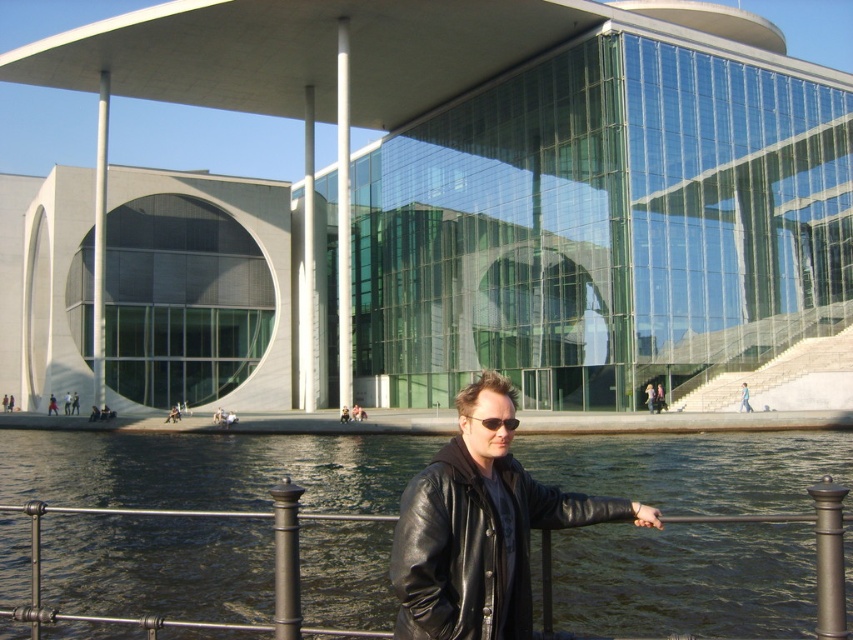
You are a tourist visiting the modern architectural structure. You want to take a photo of the glassy concrete building at center without any water in the frame. Is it possible to position yourself in such a way that the dark green water at lower center is completely out of the shot?

The glassy concrete building at center is positioned over dark green water at lower center, so it is not possible to capture the building without including the water in the frame since the water is directly beneath it.

You are standing at the edge of the water and want to walk to the black leather jacket at center. Which direction should you move relative to the dark green water at lower center?

You should move to the right of the dark green water at lower center to reach the black leather jacket at center since the dark green water is to the left of the jacket.